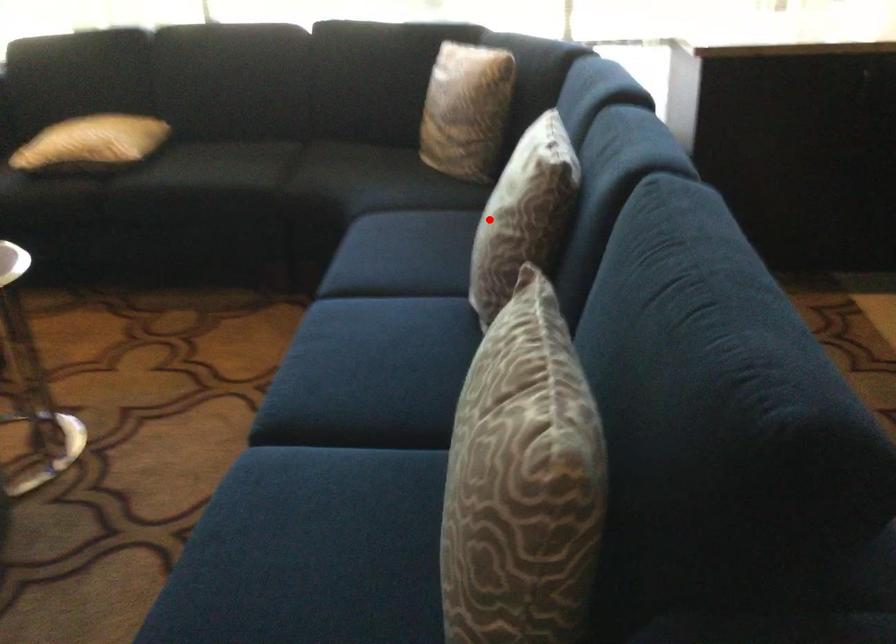
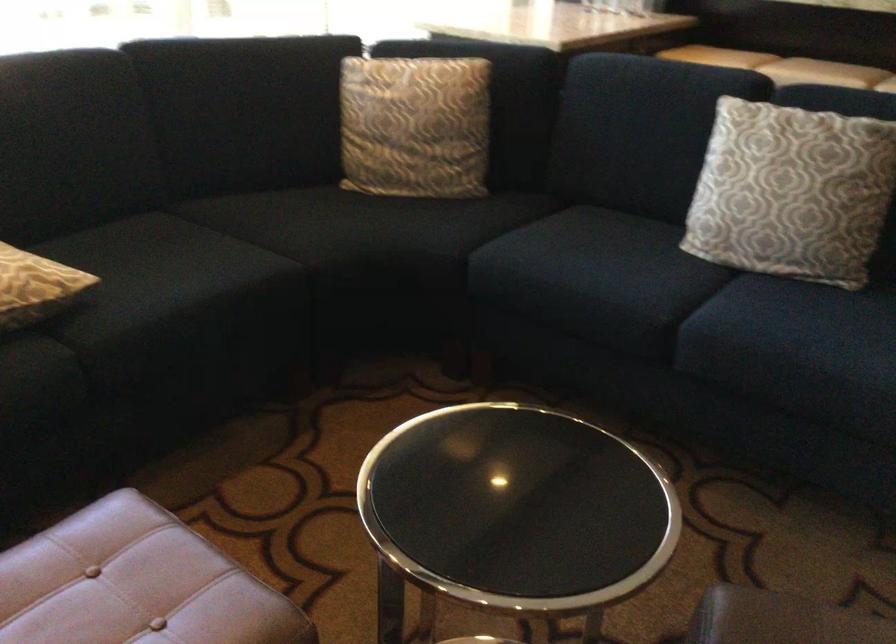
Locate, in the second image, the point that corresponds to the highlighted location in the first image.

(791, 192)